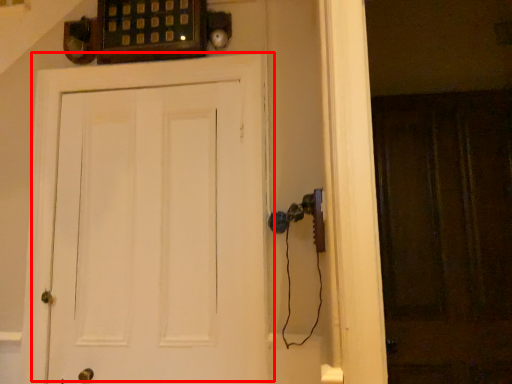
Question: From the image's perspective, what is the correct spatial positioning of door (annotated by the red box) in reference to screen door?

Choices:
 (A) below
 (B) above

Answer: (B)